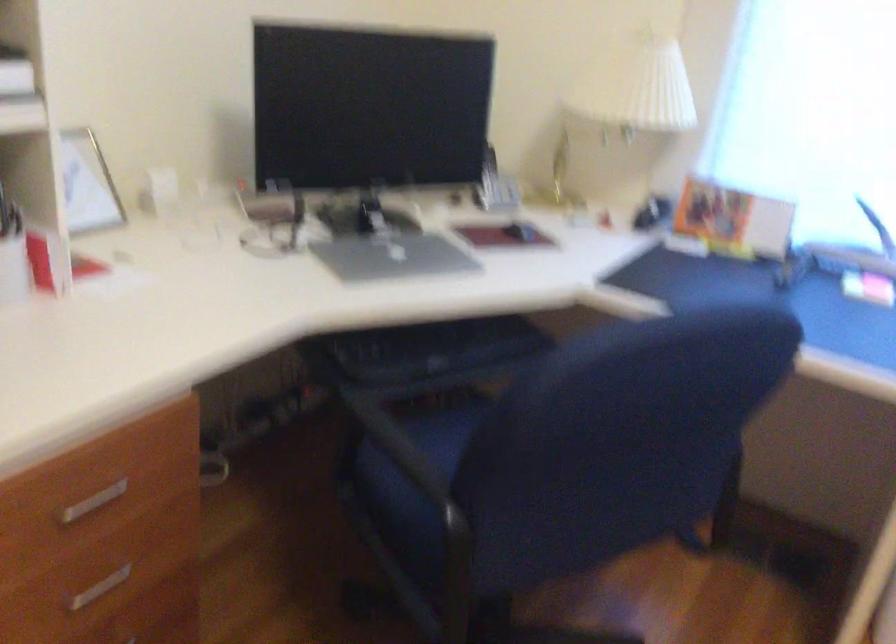
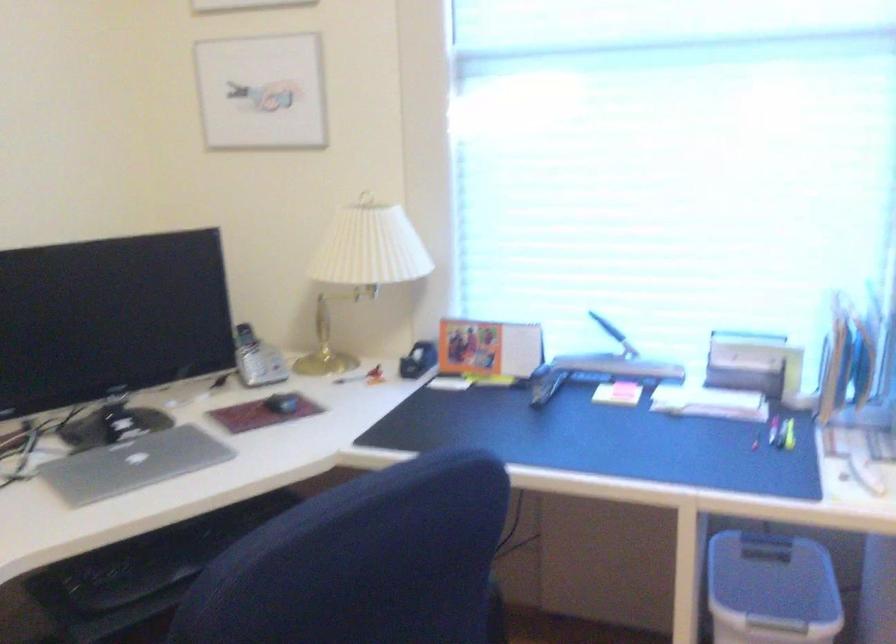
Where in the second image is the point corresponding to (390,254) from the first image?

(133, 464)